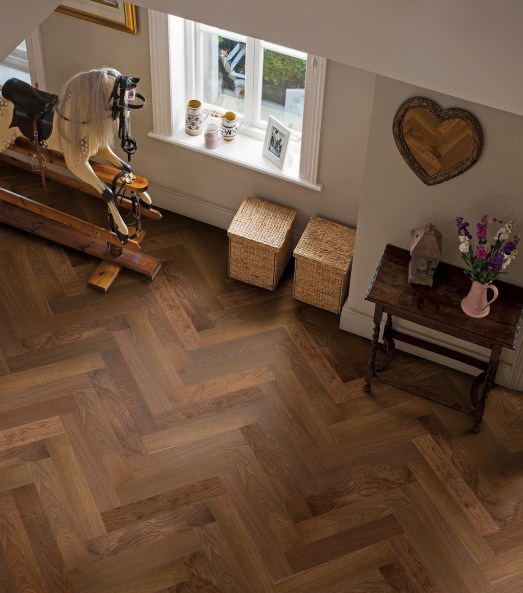
The width and height of the screenshot is (523, 593). I want to click on heart decor, so click(432, 167).